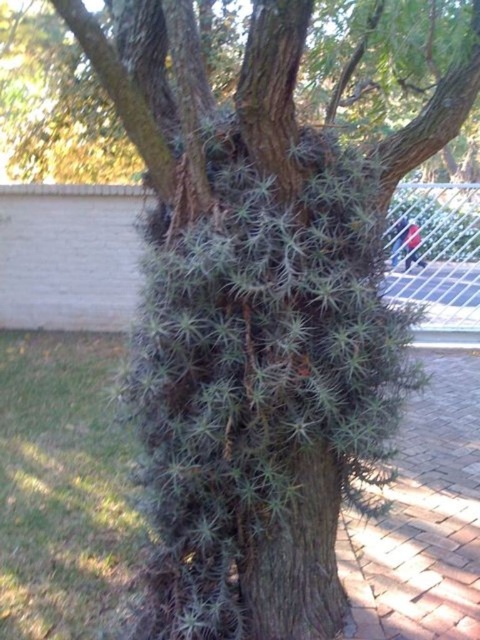
You are standing in a garden and see a tree with rough bark and a brick wall in the background. There is a point marked at coordinates (295, 547). What object is located at this point?

The point at coordinates (295, 547) marks the green spiky plant at center.